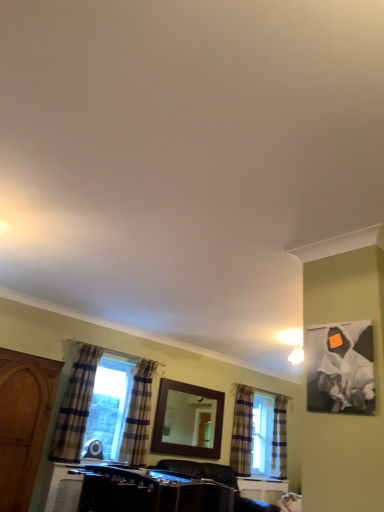
Question: Considering the relative sizes of plaid fabric curtain at right, acting as the 3th curtain starting from the front, and plaid fabric curtain at lower left, arranged as the third curtain when viewed from the back, in the image provided, is plaid fabric curtain at right, acting as the 3th curtain starting from the front, wider than plaid fabric curtain at lower left, arranged as the third curtain when viewed from the back,?

Choices:
 (A) yes
 (B) no

Answer: (B)

Question: Can you confirm if plaid fabric curtain at right, the second curtain in the right-to-left sequence, is thinner than plaid fabric curtain at lower left, arranged as the third curtain when viewed from the back?

Choices:
 (A) no
 (B) yes

Answer: (B)

Question: Does plaid fabric curtain at right, acting as the 3th curtain starting from the front, come behind plaid fabric curtain at lower left, which ranks as the second curtain in left-to-right order?

Choices:
 (A) yes
 (B) no

Answer: (A)

Question: Considering the relative positions of plaid fabric curtain at right, acting as the 3th curtain starting from the front, and plaid fabric curtain at lower left, which is the 3th curtain from right to left, in the image provided, is plaid fabric curtain at right, acting as the 3th curtain starting from the front, to the right of plaid fabric curtain at lower left, which is the 3th curtain from right to left, from the viewer's perspective?

Choices:
 (A) no
 (B) yes

Answer: (B)

Question: Is plaid fabric curtain at right, acting as the third curtain starting from the left, outside plaid fabric curtain at lower left, which is the 3th curtain from right to left?

Choices:
 (A) yes
 (B) no

Answer: (A)

Question: Considering the positions of plaid fabric curtain at left, which is counted as the 4th curtain, starting from the right, and black canvas painting at upper right in the image, is plaid fabric curtain at left, which is counted as the 4th curtain, starting from the right, wider or thinner than black canvas painting at upper right?

Choices:
 (A) thin
 (B) wide

Answer: (B)

Question: In terms of height, does plaid fabric curtain at left, which ranks as the first curtain in front-to-back order, look taller or shorter compared to black canvas painting at upper right?

Choices:
 (A) tall
 (B) short

Answer: (A)

Question: In terms of size, does plaid fabric curtain at left, which ranks as the first curtain in front-to-back order, appear bigger or smaller than black canvas painting at upper right?

Choices:
 (A) small
 (B) big

Answer: (B)

Question: Is plaid fabric curtain at left, which is counted as the 4th curtain, starting from the right, in front of or behind black canvas painting at upper right in the image?

Choices:
 (A) behind
 (B) front

Answer: (A)

Question: Based on their sizes in the image, would you say black glossy vanity at lower center is bigger or smaller than plaid fabric curtain at lower left, acting as the 2th curtain starting from the front?

Choices:
 (A) big
 (B) small

Answer: (A)

Question: From the image's perspective, is black glossy vanity at lower center above or below plaid fabric curtain at lower left, arranged as the third curtain when viewed from the back?

Choices:
 (A) above
 (B) below

Answer: (B)

Question: Would you say black glossy vanity at lower center is inside or outside plaid fabric curtain at lower left, acting as the 2th curtain starting from the front?

Choices:
 (A) inside
 (B) outside

Answer: (B)

Question: Is black glossy vanity at lower center to the left or to the right of plaid fabric curtain at lower left, arranged as the third curtain when viewed from the back, in the image?

Choices:
 (A) left
 (B) right

Answer: (B)

Question: Is plaid fabric curtain at right, the 2th curtain from the back, taller or shorter than plaid fabric curtain at lower left, which ranks as the second curtain in left-to-right order?

Choices:
 (A) short
 (B) tall

Answer: (B)

Question: Would you say plaid fabric curtain at right, the second curtain in the right-to-left sequence, is to the left or to the right of plaid fabric curtain at lower left, which ranks as the second curtain in left-to-right order, in the picture?

Choices:
 (A) right
 (B) left

Answer: (A)